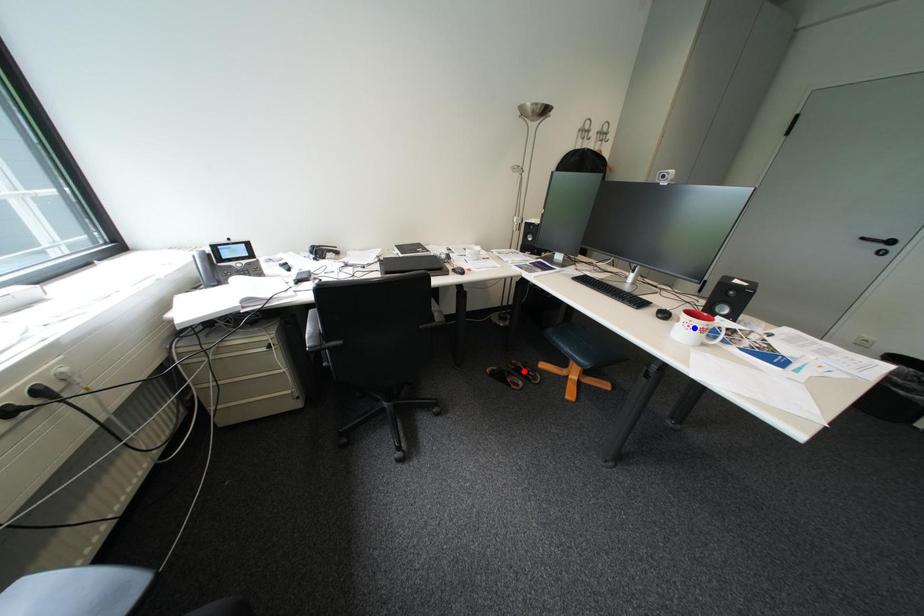
Question: Two points are marked on the image. Which point is closer to the camera?

Choices:
 (A) Blue point is closer.
 (B) Red point is closer.

Answer: (A)